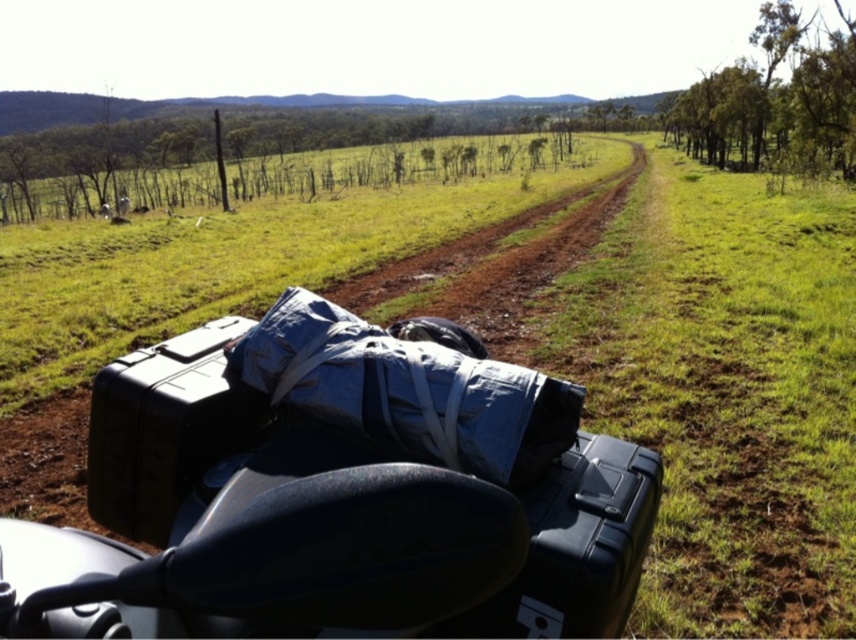
Question: Based on their relative distances, which object is nearer to the brown dirt track at center?

Choices:
 (A) black hard case at lower left
 (B) black hard case at lower right

Answer: (B)

Question: Can you confirm if brown dirt track at center is thinner than black hard case at lower left?

Choices:
 (A) no
 (B) yes

Answer: (A)

Question: Which point is farther to the camera?

Choices:
 (A) (419, 289)
 (B) (97, 465)
 (C) (607, 598)

Answer: (A)

Question: Does black hard case at lower left appear on the right side of black hard case at lower right?

Choices:
 (A) no
 (B) yes

Answer: (A)

Question: Where is brown dirt track at center located in relation to black hard case at lower left in the image?

Choices:
 (A) right
 (B) left

Answer: (B)

Question: Which object is farther from the camera taking this photo?

Choices:
 (A) black hard case at lower left
 (B) brown dirt track at center

Answer: (B)